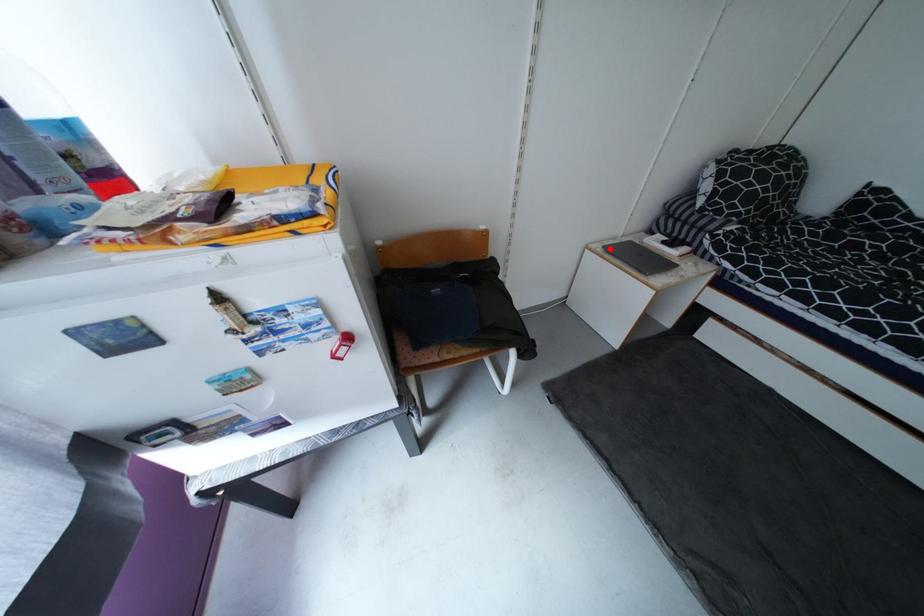
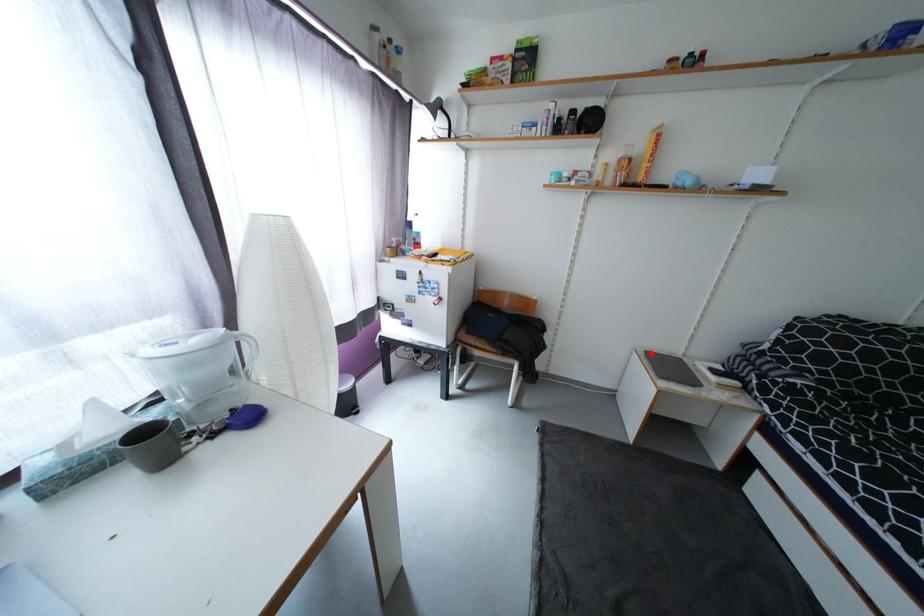
I am providing you with two images of the same scene from different viewpoints. A red point is marked on the first image and another point is marked on the second image. Is the red point in image1 aligned with the point shown in image2?

Yes